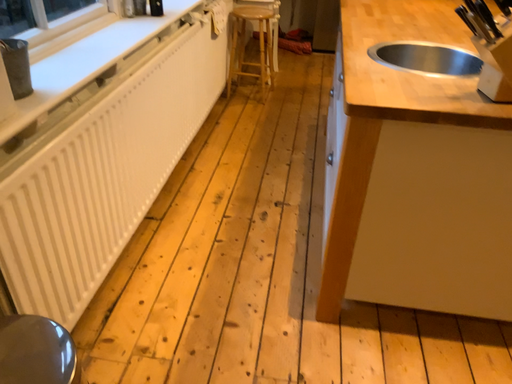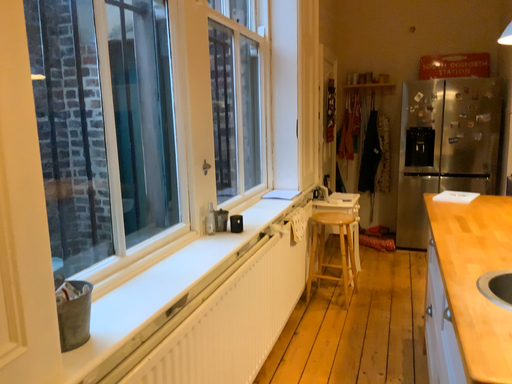
Question: How did the camera likely rotate when shooting the video?

Choices:
 (A) rotated upward
 (B) rotated downward

Answer: (A)